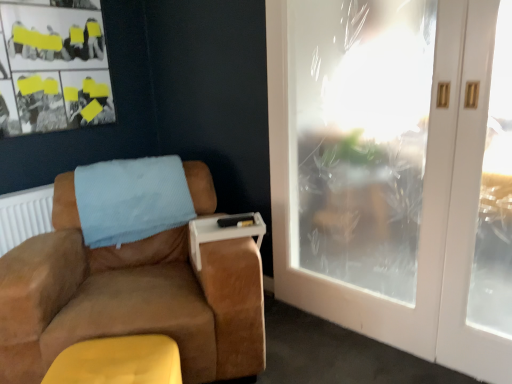
Question: Could yellow suede footrest at lower left be considered to be inside suede brown armchair at left?

Choices:
 (A) yes
 (B) no

Answer: (B)

Question: From a real-world perspective, is suede brown armchair at left physically below yellow suede footrest at lower left?

Choices:
 (A) yes
 (B) no

Answer: (B)

Question: Is suede brown armchair at left wider than yellow suede footrest at lower left?

Choices:
 (A) no
 (B) yes

Answer: (B)

Question: Is suede brown armchair at left bigger than yellow suede footrest at lower left?

Choices:
 (A) no
 (B) yes

Answer: (B)

Question: Is suede brown armchair at left oriented towards yellow suede footrest at lower left?

Choices:
 (A) no
 (B) yes

Answer: (B)

Question: Is suede brown armchair at left outside of yellow suede footrest at lower left?

Choices:
 (A) no
 (B) yes

Answer: (B)

Question: From the image's perspective, is light blue textured blanket at upper left above suede brown armchair at left?

Choices:
 (A) no
 (B) yes

Answer: (B)

Question: Considering the relative sizes of light blue textured blanket at upper left and suede brown armchair at left in the image provided, is light blue textured blanket at upper left taller than suede brown armchair at left?

Choices:
 (A) yes
 (B) no

Answer: (B)

Question: Can you confirm if light blue textured blanket at upper left is positioned to the left of suede brown armchair at left?

Choices:
 (A) no
 (B) yes

Answer: (B)

Question: Is light blue textured blanket at upper left at the right side of suede brown armchair at left?

Choices:
 (A) yes
 (B) no

Answer: (B)

Question: Is light blue textured blanket at upper left facing towards suede brown armchair at left?

Choices:
 (A) yes
 (B) no

Answer: (A)

Question: Does light blue textured blanket at upper left have a larger size compared to suede brown armchair at left?

Choices:
 (A) yes
 (B) no

Answer: (B)

Question: Does suede brown armchair at left lie behind white plastic tray at armrest?

Choices:
 (A) no
 (B) yes

Answer: (A)